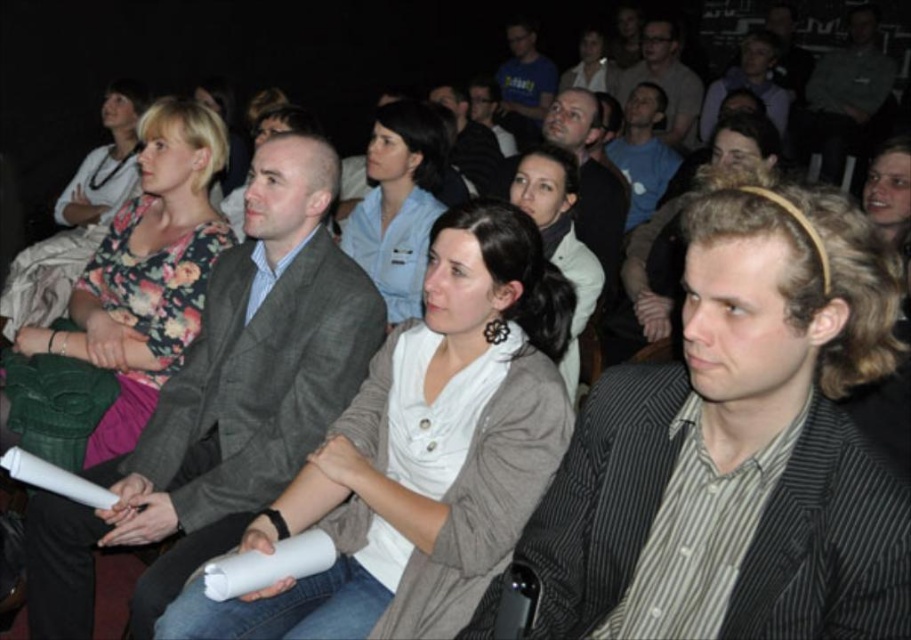
Question: Can you confirm if floral print blouse at upper left is wider than white shirt at center?

Choices:
 (A) no
 (B) yes

Answer: (B)

Question: Which is nearer to the striped cotton shirt at center?

Choices:
 (A) floral print blouse at upper left
 (B) matte gray suit at upper center
 (C) light blue shirt at center
 (D) white shirt at center

Answer: (D)

Question: Can you confirm if white matte shirt at center is positioned to the right of matte gray suit at upper center?

Choices:
 (A) yes
 (B) no

Answer: (B)

Question: Can you confirm if light blue shirt at center is positioned to the left of matte gray suit at upper center?

Choices:
 (A) no
 (B) yes

Answer: (B)

Question: Among these objects, which one is farthest from the camera?

Choices:
 (A) light blue shirt at center
 (B) white shirt at center
 (C) striped cotton shirt at center

Answer: (A)

Question: Which object is the farthest from the striped cotton shirt at center?

Choices:
 (A) light blue shirt at center
 (B) gray woolen suit at center
 (C) white matte shirt at center

Answer: (A)